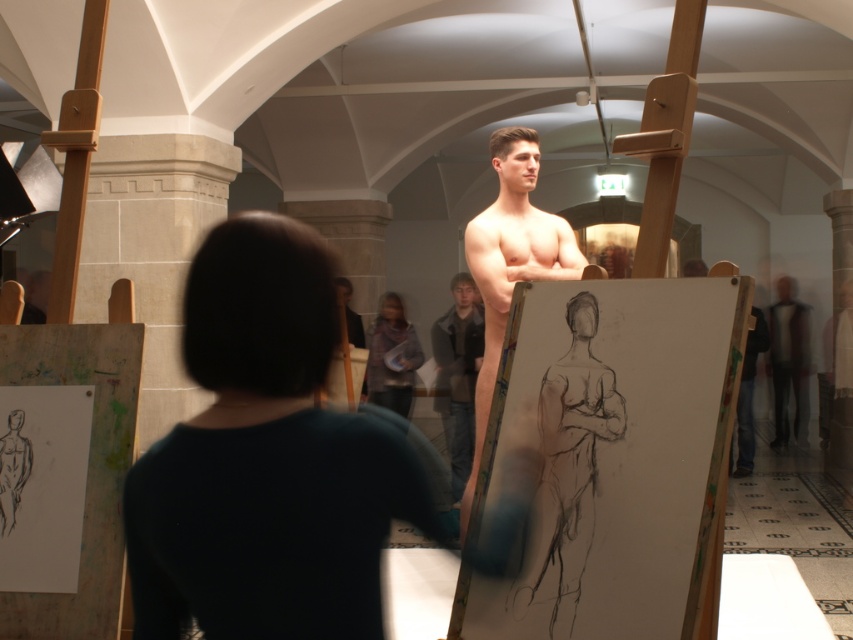
You are an artist in the studio and want to place a new canvas between the smooth skin mannequin at center and the dark brown leather jacket at center. Can you do this without moving either object?

The smooth skin mannequin at center is in front of the dark brown leather jacket at center, so there is space between them where you can place the new canvas.

Based on the scene description, where is the smooth skin man at center located in terms of coordinates?

The smooth skin man at center is located at point coordinates of (265,460).

You are an art student in the studio. You need to place a small stool between the smooth skin man at center and the smooth skin mannequin at center. Which one should you place the stool closer to in order to avoid blocking the view of the mannequin?

The smooth skin man at center is positioned under the smooth skin mannequin at center, so placing the stool closer to the smooth skin man at center would avoid blocking the view of the mannequin.